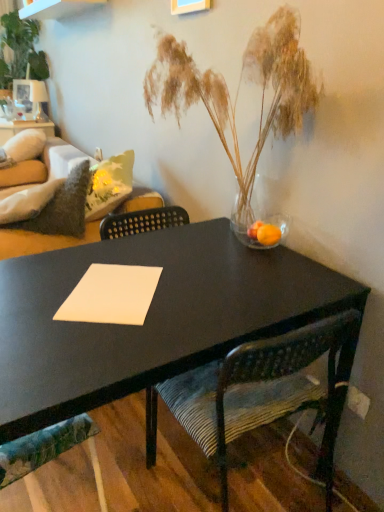
Question: Is velvet green couch at left not within translucent glass vase with dried grasses at center?

Choices:
 (A) yes
 (B) no

Answer: (A)

Question: Considering the relative sizes of velvet green couch at left and translucent glass vase with dried grasses at center in the image provided, is velvet green couch at left smaller than translucent glass vase with dried grasses at center?

Choices:
 (A) yes
 (B) no

Answer: (A)

Question: Does velvet green couch at left come behind translucent glass vase with dried grasses at center?

Choices:
 (A) yes
 (B) no

Answer: (A)

Question: From a real-world perspective, is velvet green couch at left beneath translucent glass vase with dried grasses at center?

Choices:
 (A) no
 (B) yes

Answer: (B)

Question: Could translucent glass vase with dried grasses at center be considered to be inside velvet green couch at left?

Choices:
 (A) no
 (B) yes

Answer: (A)

Question: Based on their positions, is textured fabric chair at lower left, which is counted as the 1th chair, starting from the left, located to the left or right of green leafy plant at upper left?

Choices:
 (A) left
 (B) right

Answer: (B)

Question: Looking at their shapes, would you say textured fabric chair at lower left, arranged as the second chair when viewed from the right, is wider or thinner than green leafy plant at upper left?

Choices:
 (A) wide
 (B) thin

Answer: (B)

Question: In terms of size, does textured fabric chair at lower left, arranged as the second chair when viewed from the right, appear bigger or smaller than green leafy plant at upper left?

Choices:
 (A) big
 (B) small

Answer: (B)

Question: Is textured fabric chair at lower left, arranged as the second chair when viewed from the right, situated inside green leafy plant at upper left or outside?

Choices:
 (A) outside
 (B) inside

Answer: (A)

Question: From a real-world perspective, is wooden textured chair at center, acting as the 2th chair starting from the left, positioned above or below textured fabric chair at lower left, which is counted as the 1th chair, starting from the left?

Choices:
 (A) above
 (B) below

Answer: (A)

Question: Considering the positions of point (240, 352) and point (54, 457), is point (240, 352) closer or farther from the camera than point (54, 457)?

Choices:
 (A) farther
 (B) closer

Answer: (B)

Question: Based on their positions, is wooden textured chair at center, acting as the 2th chair starting from the left, located to the left or right of textured fabric chair at lower left, arranged as the second chair when viewed from the right?

Choices:
 (A) left
 (B) right

Answer: (B)

Question: Considering their positions, is wooden textured chair at center, acting as the 2th chair starting from the left, located in front of or behind textured fabric chair at lower left, arranged as the second chair when viewed from the right?

Choices:
 (A) front
 (B) behind

Answer: (A)

Question: Visually, is white paper at center positioned to the left or to the right of velvet green couch at left?

Choices:
 (A) right
 (B) left

Answer: (A)

Question: Considering the positions of white paper at center and velvet green couch at left in the image, is white paper at center taller or shorter than velvet green couch at left?

Choices:
 (A) tall
 (B) short

Answer: (B)